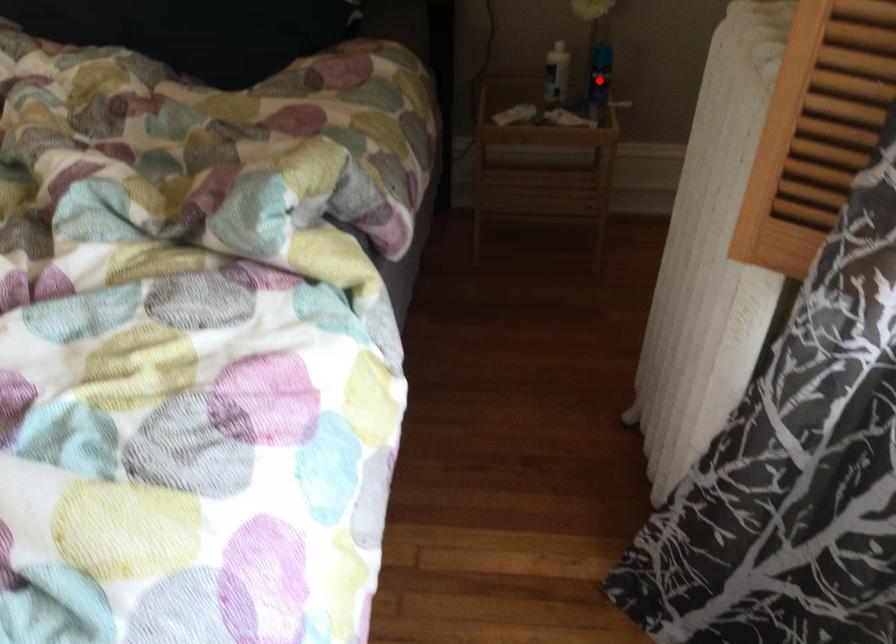
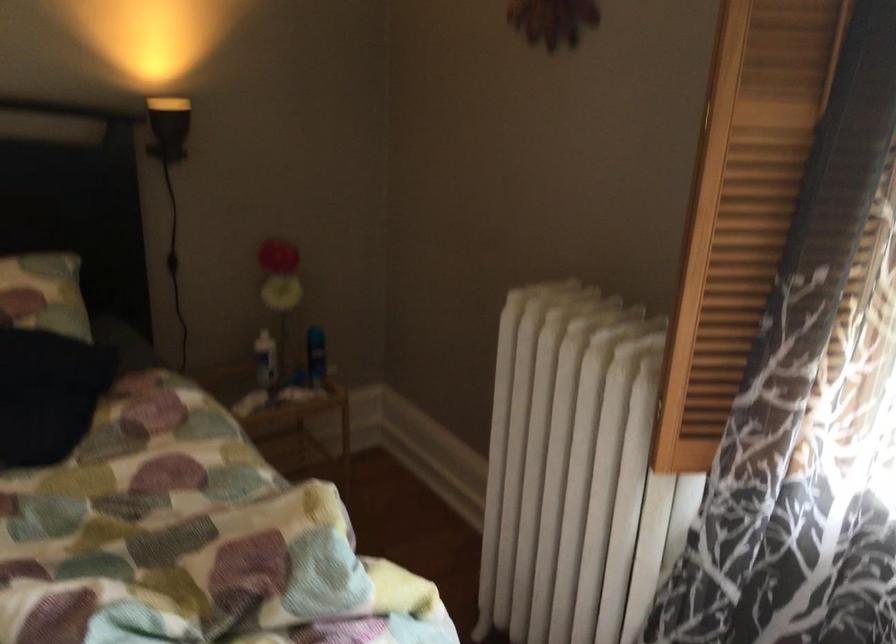
Question: I am providing you with two images of the same scene from different viewpoints. A red point is marked on the first image. Can you still see the location of the red point in image 2?

Choices:
 (A) Yes
 (B) No

Answer: (B)